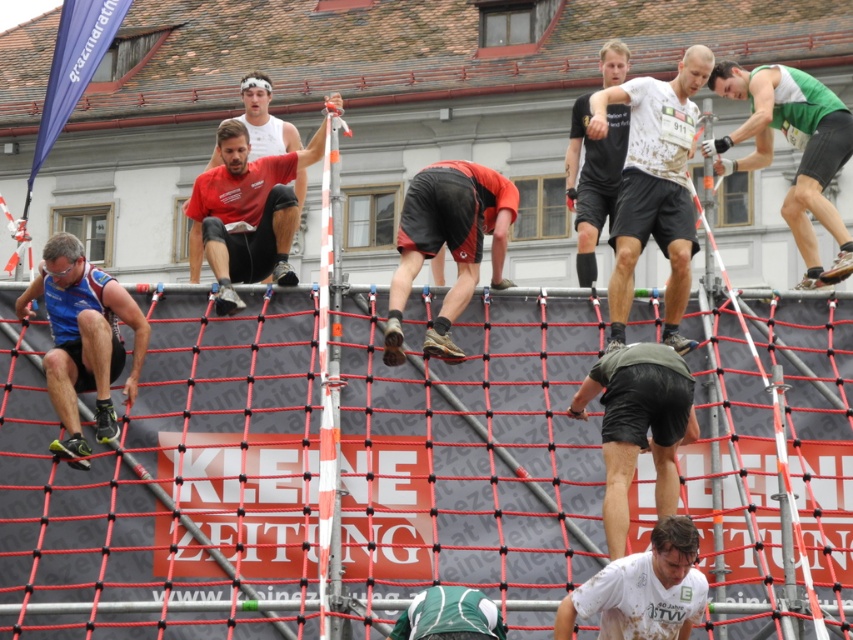
From the picture: You are a photographer positioned at the scene. You need to capture a photo of both the matte red shirt at upper center and the black matte shorts at upper center in the same frame. The camera has a maximum focal length that allows capturing objects up to 12 meters apart. Will you be able to include both in the frame?

The matte red shirt at upper center is 11.94 meters from the black matte shorts at upper center. Since the distance is under 12 meters, the camera can capture both in the same frame.

You are a photographer at the obstacle course event. You need to capture a photo of the green matte shorts at center and the black matte shorts at upper center. Which pair of shorts is narrower in width?

The green matte shorts at center has a lesser width compared to black matte shorts at upper center, so the green matte shorts at center is narrower.